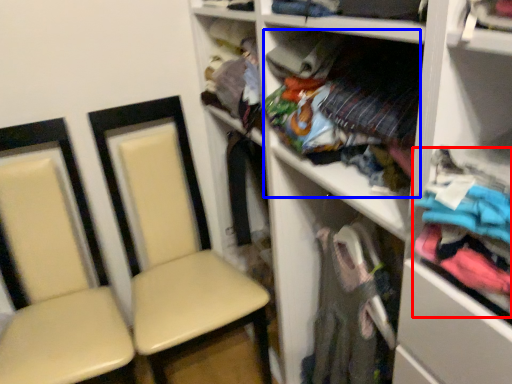
Question: Which object appears closest to the camera in this image, clothing (highlighted by a red box) or clothing (highlighted by a blue box)?

Choices:
 (A) clothing
 (B) clothing

Answer: (A)